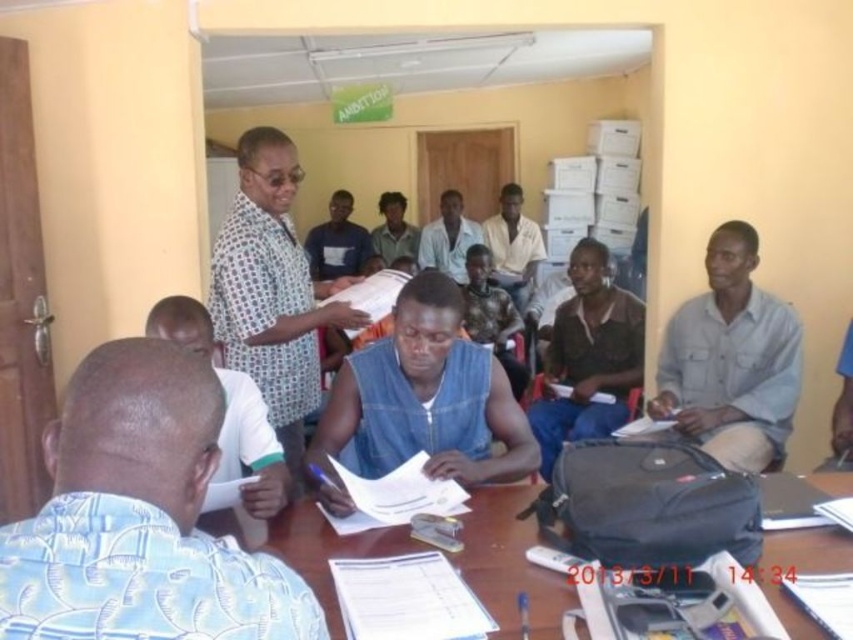
Question: Which object is the closest to the blue floral shirt at lower left?

Choices:
 (A) light blue shirt at center
 (B) light brown shirt at center
 (C) patterned fabric shirt at center
 (D) denim vest at center

Answer: (D)

Question: Among these points, which one is farthest from the camera?

Choices:
 (A) (196, 616)
 (B) (500, 602)
 (C) (492, 276)

Answer: (C)

Question: In this image, where is patterned fabric shirt at center located relative to wooden table at center?

Choices:
 (A) below
 (B) above

Answer: (B)

Question: Among these points, which one is nearest to the camera?

Choices:
 (A) (624, 422)
 (B) (309, 371)
 (C) (456, 244)
 (D) (732, 252)

Answer: (B)

Question: Is denim vest at center bigger than brown textured shirt at center?

Choices:
 (A) yes
 (B) no

Answer: (B)

Question: Does wooden table at center have a lesser width compared to white cotton shirt at lower left?

Choices:
 (A) yes
 (B) no

Answer: (B)